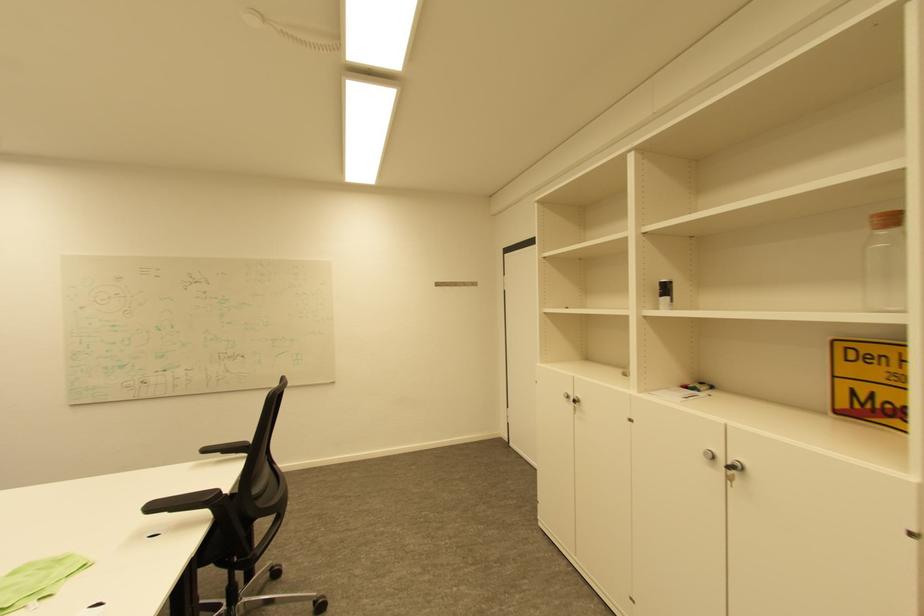
The location [665,294] corresponds to which object?

This point indicates the small black container.